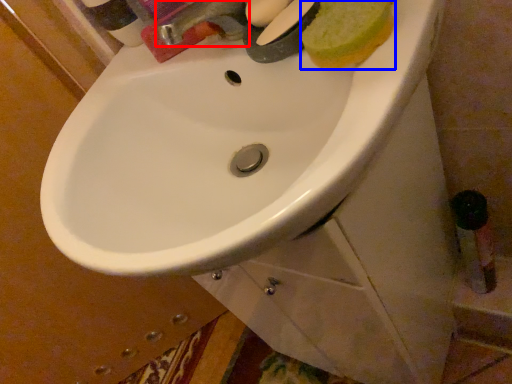
Question: Which object is further to the camera taking this photo, tap (highlighted by a red box) or food (highlighted by a blue box)?

Choices:
 (A) tap
 (B) food

Answer: (A)